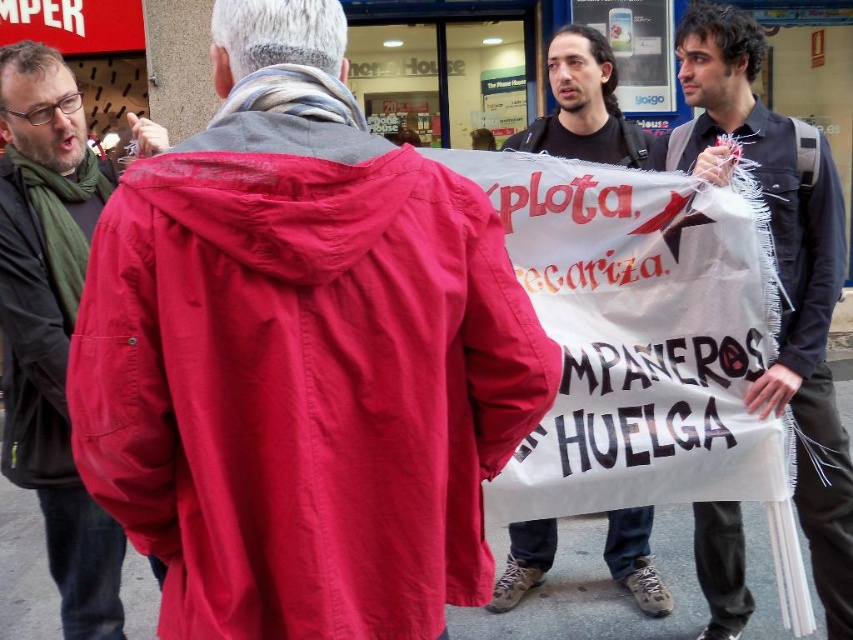
Question: Can you confirm if matte red jacket at center is bigger than black cotton t-shirt at center?

Choices:
 (A) yes
 (B) no

Answer: (A)

Question: In this image, where is matte red jacket at center located relative to matte black jacket at left?

Choices:
 (A) left
 (B) right

Answer: (B)

Question: Where is matte black jacket at left located in relation to denim jacket at right in the image?

Choices:
 (A) left
 (B) right

Answer: (A)

Question: Among these points, which one is nearest to the camera?

Choices:
 (A) (315, 76)
 (B) (143, 145)
 (C) (527, 557)
 (D) (792, 257)

Answer: (A)

Question: Which object appears farthest from the camera in this image?

Choices:
 (A) matte red jacket at left
 (B) matte black jacket at left

Answer: (A)

Question: Among these objects, which one is nearest to the camera?

Choices:
 (A) denim jacket at center
 (B) matte red jacket at center
 (C) black cotton t-shirt at center

Answer: (B)